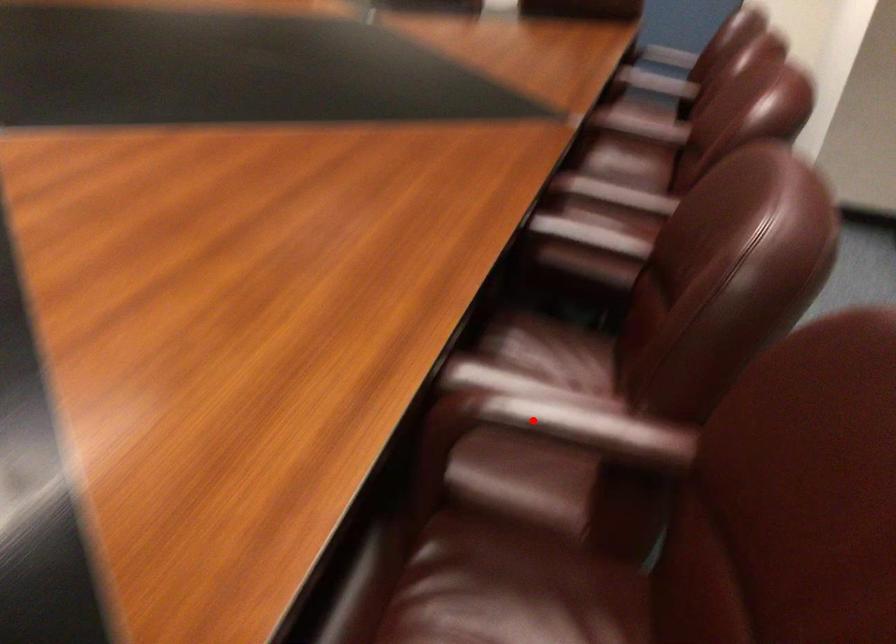
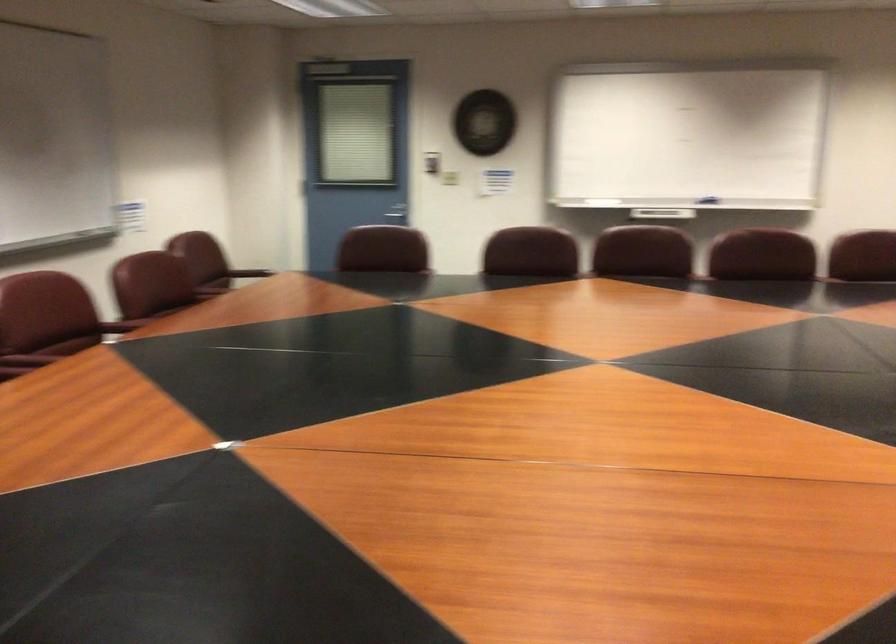
Question: I am providing you with two images of the same scene from different viewpoints. A red point is marked on the first image. Is the red point's position out of view in image 2?

Choices:
 (A) Yes
 (B) No

Answer: (A)